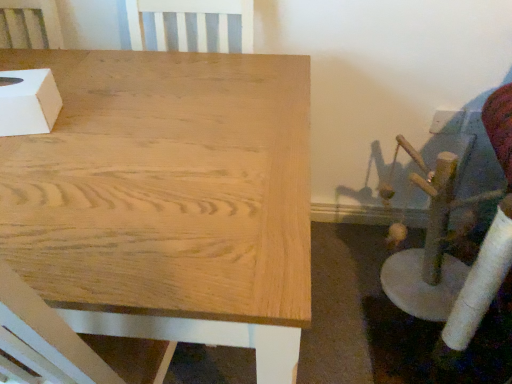
Question: Based on their sizes in the image, would you say white matte tissue box at upper left is bigger or smaller than natural wood table at center?

Choices:
 (A) small
 (B) big

Answer: (A)

Question: Is white matte tissue box at upper left inside the boundaries of natural wood table at center, or outside?

Choices:
 (A) inside
 (B) outside

Answer: (B)

Question: From a real-world perspective, is white matte tissue box at upper left above or below natural wood table at center?

Choices:
 (A) above
 (B) below

Answer: (A)

Question: Is natural wood table at center taller or shorter than white matte tissue box at upper left?

Choices:
 (A) short
 (B) tall

Answer: (B)

Question: Based on their sizes in the image, would you say natural wood table at center is bigger or smaller than white matte tissue box at upper left?

Choices:
 (A) big
 (B) small

Answer: (A)

Question: Looking at their shapes, would you say natural wood table at center is wider or thinner than white matte tissue box at upper left?

Choices:
 (A) thin
 (B) wide

Answer: (B)

Question: Is natural wood table at center to the left or to the right of white matte tissue box at upper left in the image?

Choices:
 (A) left
 (B) right

Answer: (B)